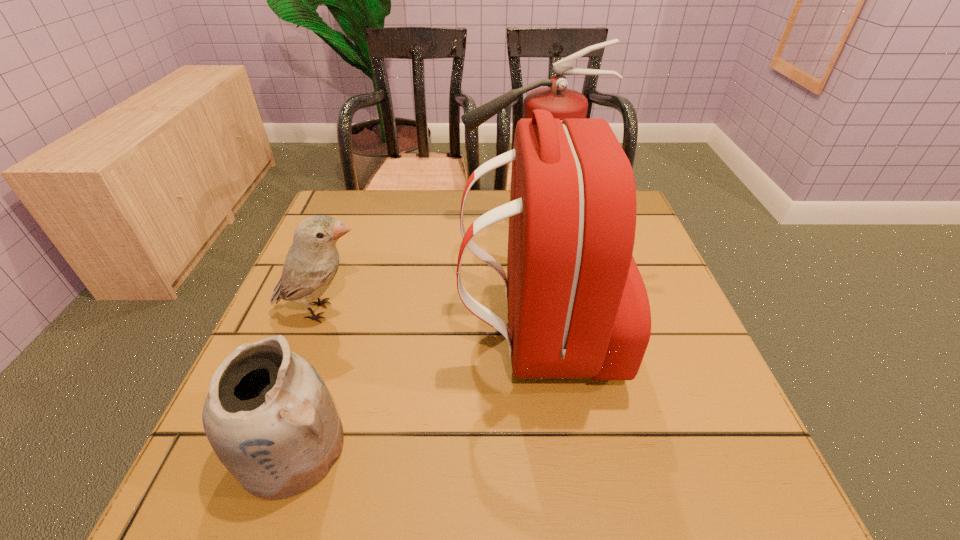
Identify the location of free spot that satisfies the following two spatial constraints: 1. on the strap side of the backpack; 2. on the front side of the pottery. This screenshot has height=540, width=960. (552, 449).

I want to click on vacant point that satisfies the following two spatial constraints: 1. at the face of the bird; 2. on the right side of the pottery, so click(271, 449).

Identify the location of vacant space that satisfies the following two spatial constraints: 1. at the nozzle of the farthest object; 2. on the front side of the pottery. This screenshot has width=960, height=540. (563, 449).